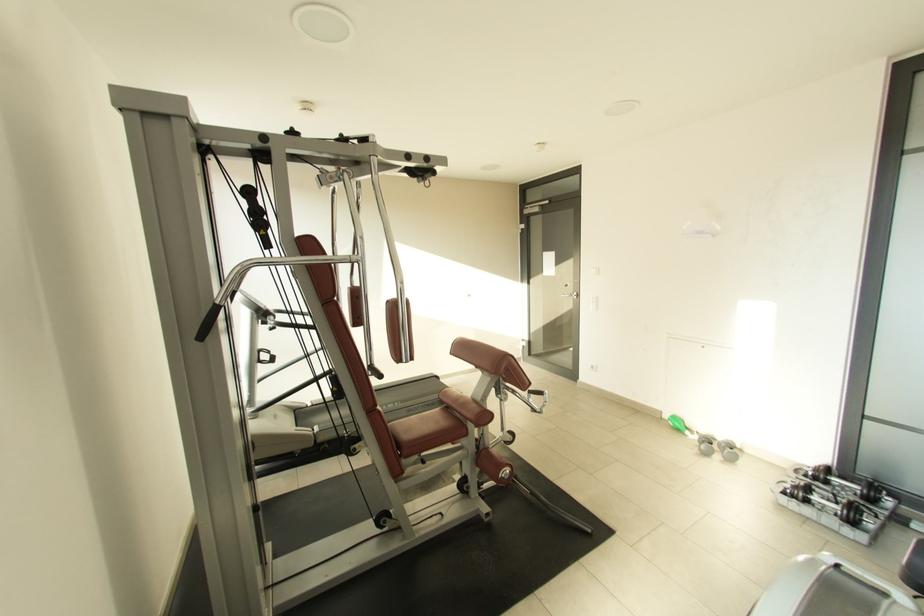
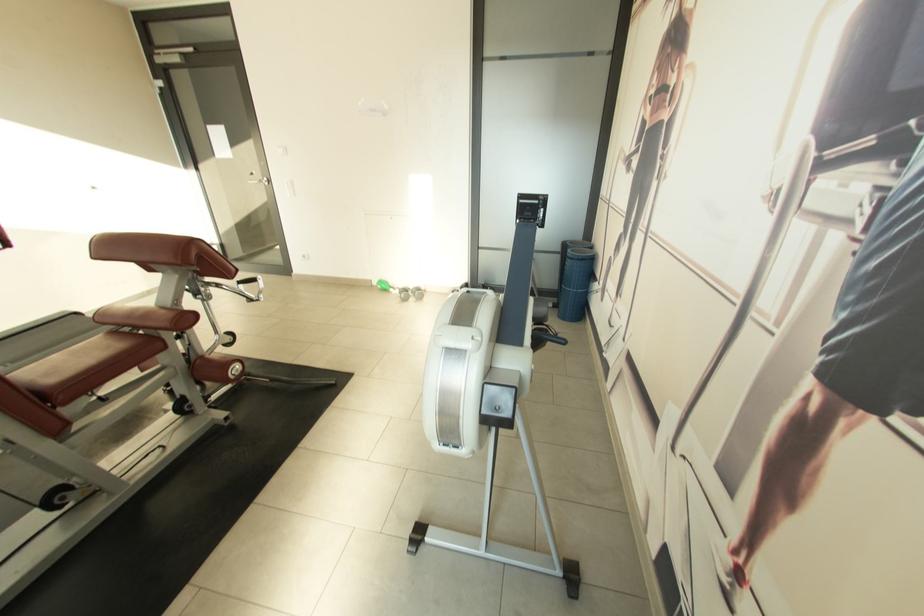
In the second image, find the point that corresponds to pixel 485 405 in the first image.

(178, 309)